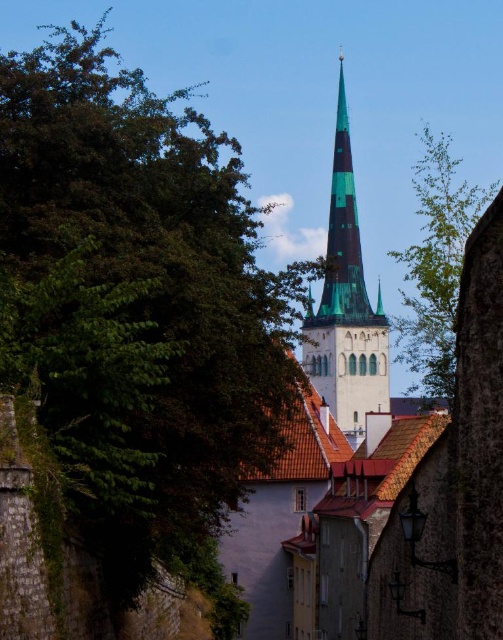
You are a tourist in the historic town and want to take a photo of both the green glass spire at center and the green leafy tree at upper right. Which object appears narrower in the photo?

The green glass spire at center appears narrower in the photo than the green leafy tree at upper right because it is thinner.

You are standing in the historic town square and want to take a photo of the green glass spire at center. Your camera has a maximum zoom range of 100 meters. Can you capture the spire without moving closer?

The green glass spire at center and camera are 92.84 meters apart. Since the camera can zoom up to 100 meters, you can capture the spire without moving closer.

You are a tourist standing in the town square and want to take a photo of both the green glass spire at center and the green leafy tree at upper right. Based on their positions, which object should you position closer to the left side of your camera frame to include both in the photo?

The green glass spire at center is to the left of the green leafy tree at upper right, so you should position the green glass spire at center closer to the left side of your camera frame to include both in the photo.